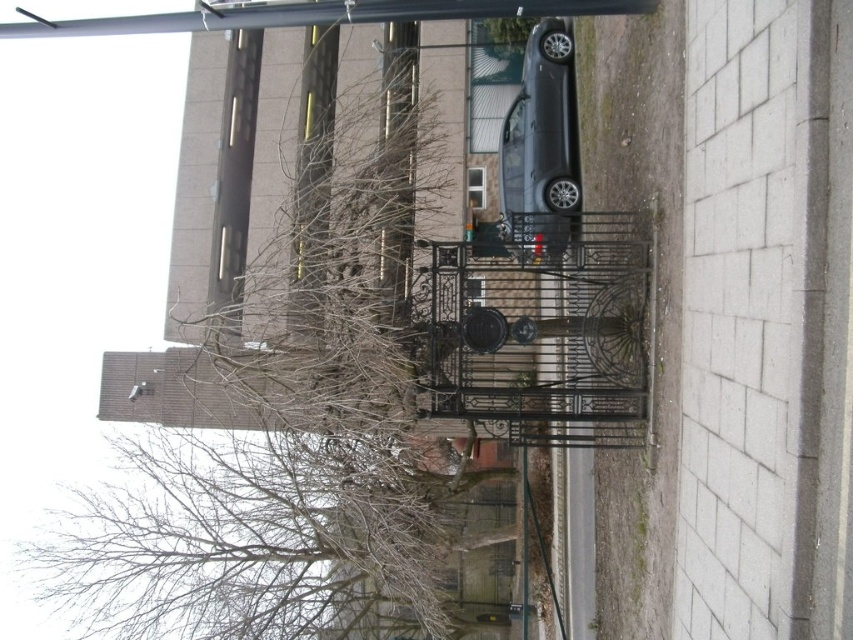
Can you confirm if black wrought iron gate at center is smaller than satin black car at center?

Actually, black wrought iron gate at center might be larger than satin black car at center.

Image resolution: width=853 pixels, height=640 pixels. What are the coordinates of `black wrought iron gate at center` in the screenshot? It's located at (538, 333).

Where is `black wrought iron gate at center`? The height and width of the screenshot is (640, 853). black wrought iron gate at center is located at coordinates (538, 333).